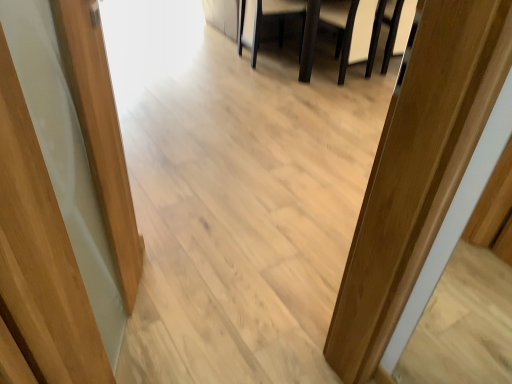
Question: Considering the relative sizes of dark brown leather armchair at center, placed as the second armchair when sorted from right to left, and white leather armchair at upper center, which ranks as the second armchair in left-to-right order, in the image provided, is dark brown leather armchair at center, placed as the second armchair when sorted from right to left, shorter than white leather armchair at upper center, which ranks as the second armchair in left-to-right order,?

Choices:
 (A) no
 (B) yes

Answer: (B)

Question: Is dark brown leather armchair at center, placed as the second armchair when sorted from right to left, outside of white leather armchair at upper center, marked as the first armchair in a right-to-left arrangement?

Choices:
 (A) no
 (B) yes

Answer: (B)

Question: Is white leather armchair at upper center, marked as the first armchair in a right-to-left arrangement, surrounded by dark brown leather armchair at center, the first armchair in the left-to-right sequence?

Choices:
 (A) no
 (B) yes

Answer: (A)

Question: From a real-world perspective, is dark brown leather armchair at center, the first armchair in the left-to-right sequence, located higher than white leather armchair at upper center, which ranks as the second armchair in left-to-right order?

Choices:
 (A) yes
 (B) no

Answer: (B)

Question: From a real-world perspective, is dark brown leather armchair at center, the first armchair in the left-to-right sequence, beneath white leather armchair at upper center, marked as the first armchair in a right-to-left arrangement?

Choices:
 (A) no
 (B) yes

Answer: (B)

Question: Considering the positions of dark brown leather armchair at center, the first armchair in the left-to-right sequence, and white leather armchair at upper center, marked as the first armchair in a right-to-left arrangement, in the image, is dark brown leather armchair at center, the first armchair in the left-to-right sequence, bigger or smaller than white leather armchair at upper center, marked as the first armchair in a right-to-left arrangement,?

Choices:
 (A) big
 (B) small

Answer: (B)

Question: Would you say dark brown leather armchair at center, placed as the second armchair when sorted from right to left, is to the left or to the right of white leather armchair at upper center, which ranks as the second armchair in left-to-right order, in the picture?

Choices:
 (A) left
 (B) right

Answer: (A)

Question: From the image's perspective, relative to white leather armchair at upper center, marked as the first armchair in a right-to-left arrangement, is dark brown leather armchair at center, the first armchair in the left-to-right sequence, above or below?

Choices:
 (A) above
 (B) below

Answer: (A)

Question: From a real-world perspective, is dark brown leather armchair at center, placed as the second armchair when sorted from right to left, physically located above or below white leather armchair at upper center, marked as the first armchair in a right-to-left arrangement?

Choices:
 (A) below
 (B) above

Answer: (A)

Question: Considering the positions of dark brown wooden table at center and white leather armchair at upper center, marked as the first armchair in a right-to-left arrangement, in the image, is dark brown wooden table at center taller or shorter than white leather armchair at upper center, marked as the first armchair in a right-to-left arrangement,?

Choices:
 (A) short
 (B) tall

Answer: (A)

Question: From the image's perspective, is dark brown wooden table at center above or below white leather armchair at upper center, marked as the first armchair in a right-to-left arrangement?

Choices:
 (A) above
 (B) below

Answer: (A)

Question: Does point (337, 48) appear closer or farther from the camera than point (352, 29)?

Choices:
 (A) farther
 (B) closer

Answer: (A)

Question: From a real-world perspective, relative to white leather armchair at upper center, marked as the first armchair in a right-to-left arrangement, is dark brown wooden table at center vertically above or below?

Choices:
 (A) below
 (B) above

Answer: (A)

Question: Based on their sizes in the image, would you say white leather armchair at upper center, which ranks as the second armchair in left-to-right order, is bigger or smaller than dark brown wooden table at center?

Choices:
 (A) big
 (B) small

Answer: (B)

Question: From the image's perspective, is white leather armchair at upper center, marked as the first armchair in a right-to-left arrangement, positioned above or below dark brown wooden table at center?

Choices:
 (A) above
 (B) below

Answer: (B)